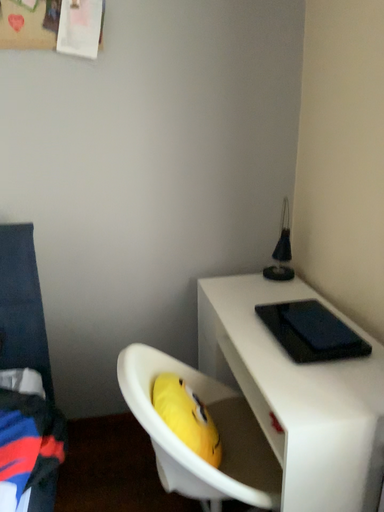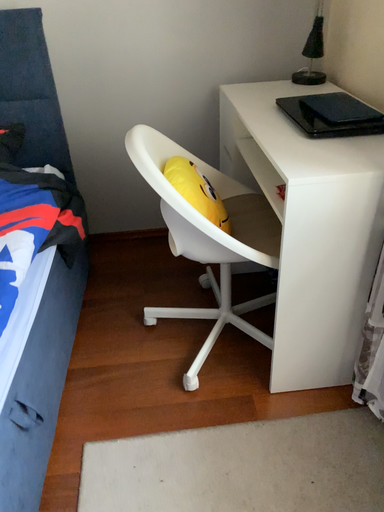
Question: Which way did the camera rotate in the video?

Choices:
 (A) rotated downward
 (B) rotated upward

Answer: (A)